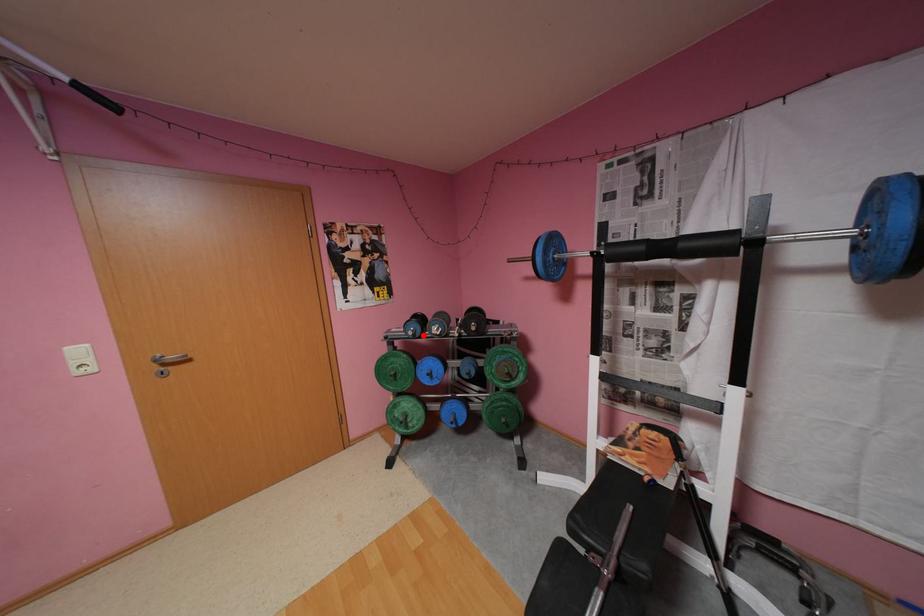
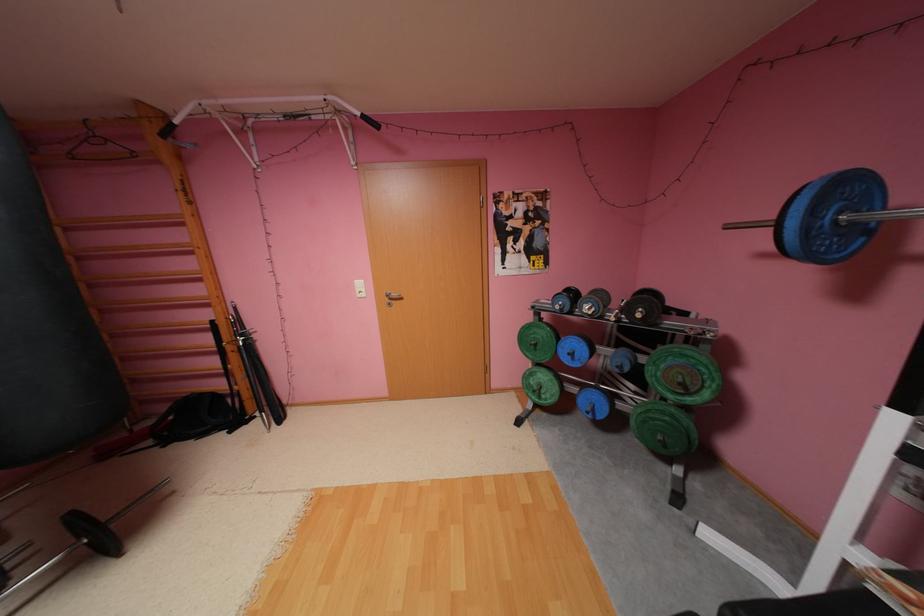
Where in the second image is the point corresponding to the highlighted location from the first image?

(570, 310)